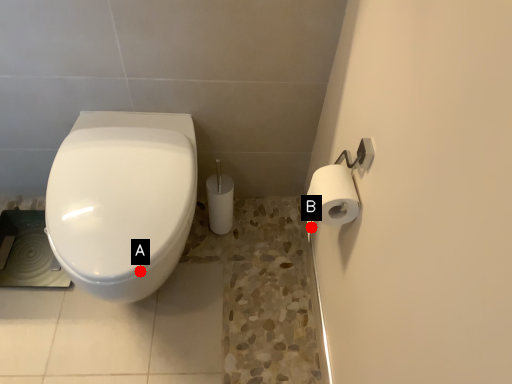
Question: Two points are circled on the image, labeled by A and B beside each circle. Which point is farther from the camera taking this photo?

Choices:
 (A) A is further
 (B) B is further

Answer: (B)